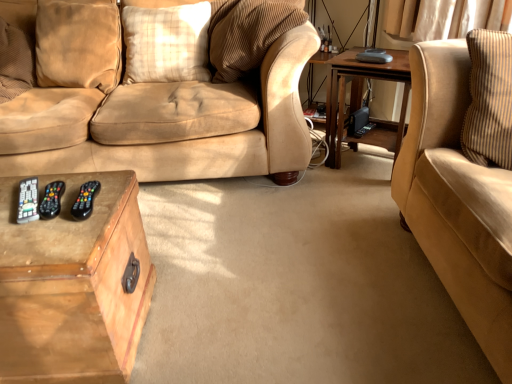
Question: Is wooden trunk at lower left, arranged as the second table when viewed from the right, inside or outside of wooden table at right, the 1th table positioned from the right?

Choices:
 (A) inside
 (B) outside

Answer: (B)

Question: Considering their positions, is wooden trunk at lower left, arranged as the second table when viewed from the right, located in front of or behind wooden table at right, the second table positioned from the left?

Choices:
 (A) front
 (B) behind

Answer: (A)

Question: Which is farther from the black plastic remote at lower left?

Choices:
 (A) suede beige couch at right
 (B) plaid fabric pillow at center, which is counted as the 1th pillow, starting from the right
 (C) wooden table at right, which is counted as the 1th table, starting from the top
 (D) wooden trunk at lower left, which appears as the second table when viewed from the back
 (E) velvet beige pillow at upper left, arranged as the 1th pillow when viewed from the left

Answer: (C)

Question: Considering the real-world distances, which object is closest to the velvet beige pillow at upper left, acting as the 2th pillow starting from the right?

Choices:
 (A) black plastic remote at lower left
 (B) plaid fabric pillow at center, which is counted as the 1th pillow, starting from the right
 (C) suede beige couch at right
 (D) wooden trunk at lower left, the 1th table from the left
 (E) wooden table at right, which is counted as the 1th table, starting from the top

Answer: (B)